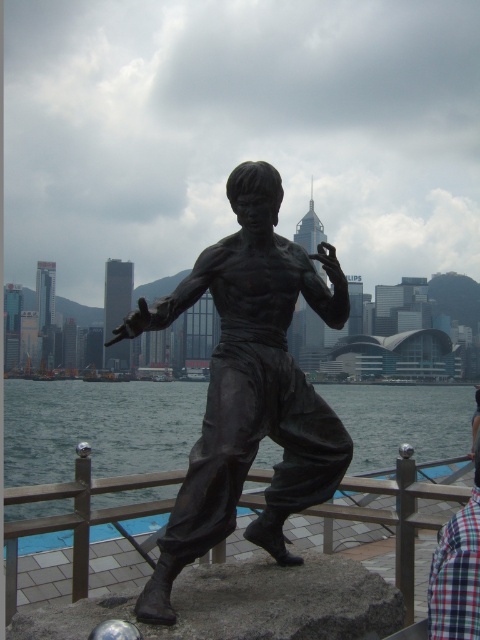
Which is behind, point (180, 305) or point (180, 422)?

Positioned behind is point (180, 422).

Who is lower down, bronze statue at center or black matte water at lower center?

black matte water at lower center is lower down.

Which is in front, point (196, 509) or point (62, 476)?

Point (196, 509) is in front.

Where is `bronze statue at center`? The image size is (480, 640). bronze statue at center is located at coordinates (250, 387).

Is brown wooden rail at lower center taller than plaid fabric shirt at lower right?

Yes.

Who is shorter, brown wooden rail at lower center or plaid fabric shirt at lower right?

Standing shorter between the two is plaid fabric shirt at lower right.

What do you see at coordinates (76, 516) in the screenshot? I see `brown wooden rail at lower center` at bounding box center [76, 516].

At what (x,y) coordinates should I click in order to perform the action: click on brown wooden rail at lower center. Please return your answer as a coordinate pair (x, y). The height and width of the screenshot is (640, 480). Looking at the image, I should click on (76, 516).

Who is lower down, bronze statue at center or brown wooden rail at lower center?

Positioned lower is brown wooden rail at lower center.

Which is behind, point (275, 477) or point (71, 490)?

The point (71, 490) is behind.

Between point (276, 220) and point (12, 531), which one is positioned behind?

Point (276, 220)

I want to click on bronze statue at center, so click(x=250, y=387).